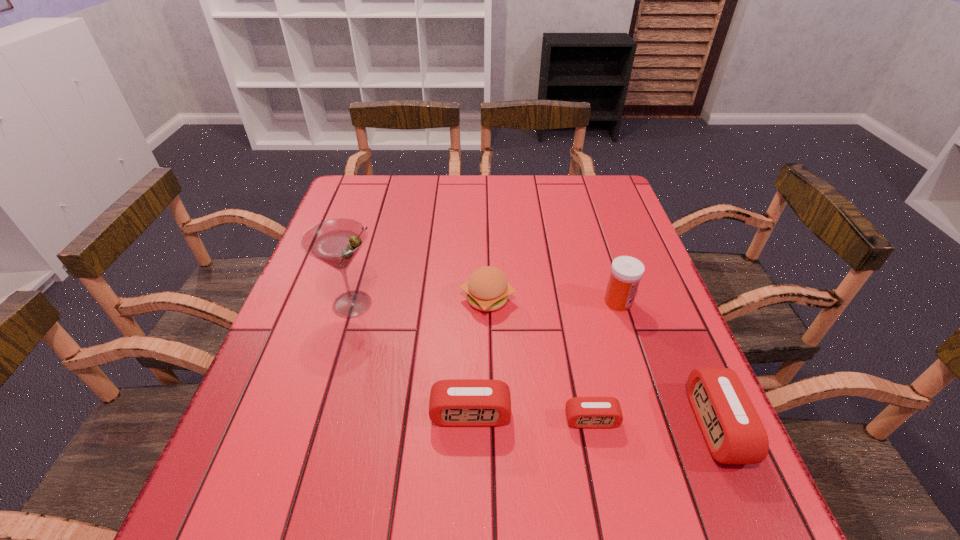
The width and height of the screenshot is (960, 540). I want to click on the second shortest alarm clock, so click(457, 402).

At what (x,y) coordinates should I click in order to perform the action: click on the fifth tallest object. Please return your answer as a coordinate pair (x, y). Image resolution: width=960 pixels, height=540 pixels. Looking at the image, I should click on (457, 402).

Find the location of a particular element. This screenshot has height=540, width=960. the shortest alarm clock is located at coordinates (582, 412).

In order to click on the shortest object in this screenshot , I will do `click(582, 412)`.

Locate an element on the screen. Image resolution: width=960 pixels, height=540 pixels. the rightmost object is located at coordinates (x=734, y=433).

The width and height of the screenshot is (960, 540). Identify the location of hamburger. (487, 289).

This screenshot has height=540, width=960. I want to click on the leftmost object, so click(335, 242).

The image size is (960, 540). Identify the location of martini. [x=335, y=242].

Where is `medicine`? This screenshot has width=960, height=540. medicine is located at coordinates (626, 272).

This screenshot has width=960, height=540. I want to click on the fifth shortest object, so click(626, 272).